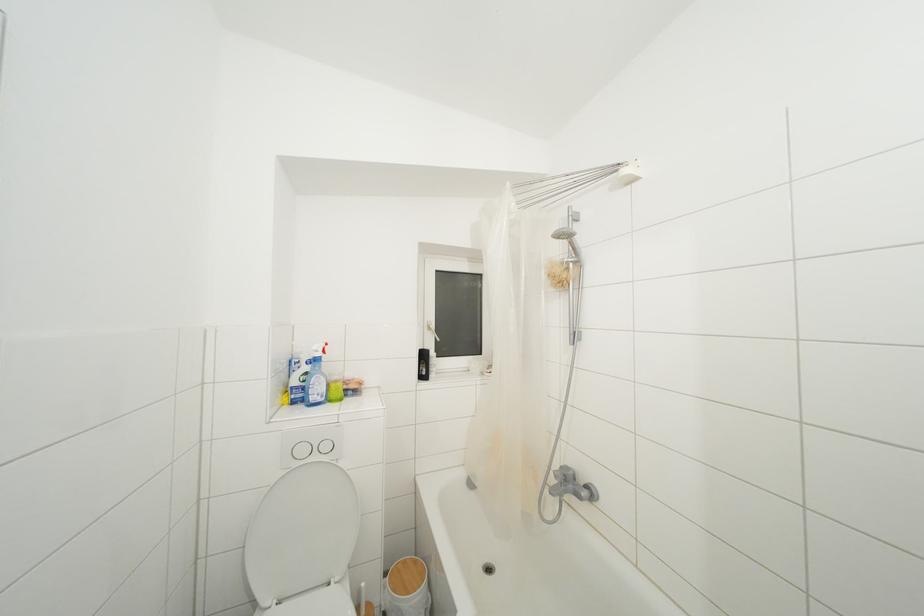
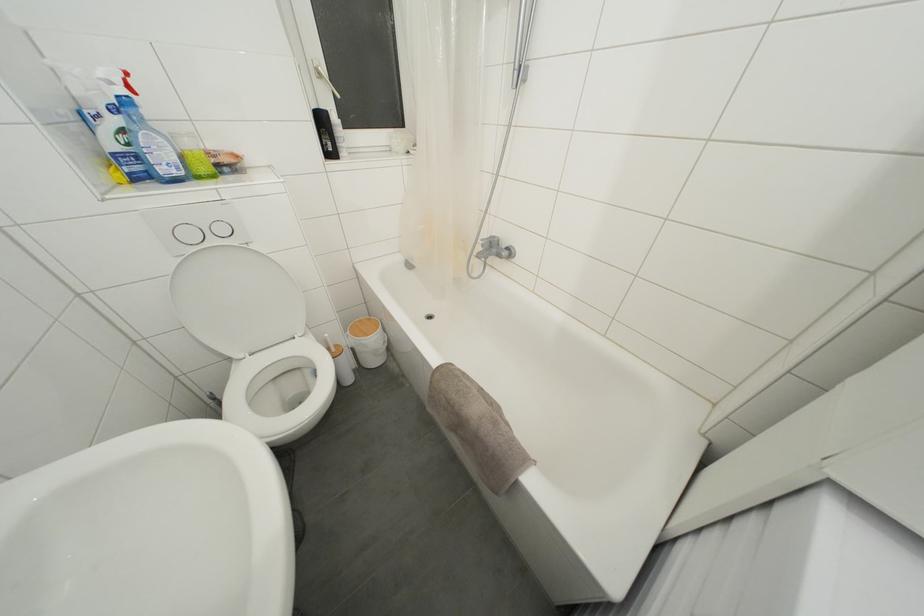
In the second image, find the point that corresponds to point (561, 469) in the first image.

(488, 240)